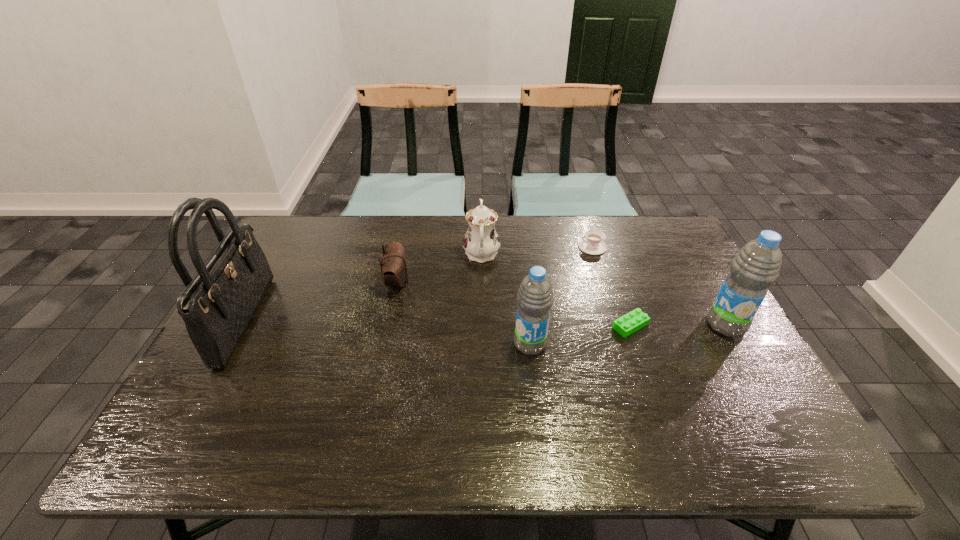
The width and height of the screenshot is (960, 540). I want to click on the leftmost object, so click(217, 305).

The width and height of the screenshot is (960, 540). Identify the location of Lego. (631, 322).

What are the coordinates of `vacant space situated 0.210m on the left of the shorter water bottle` in the screenshot? It's located at (432, 344).

This screenshot has width=960, height=540. Find the location of `vacant area situated on the left of the rightmost object`. vacant area situated on the left of the rightmost object is located at coordinates pos(617,325).

You are a GUI agent. You are given a task and a screenshot of the screen. Output one action in this format:
    pyautogui.click(x=<x>, y=<y>)
    Task: Click on the free spot located on the right of the third object from left to right
    Image resolution: width=960 pixels, height=540 pixels.
    Given the screenshot: What is the action you would take?
    pyautogui.click(x=528, y=254)

Identify the location of vacant space located 0.090m with the flap open on the pouch. (439, 282).

Find the location of `vacant point located 0.300m on the handle side of the second shortest object`. vacant point located 0.300m on the handle side of the second shortest object is located at coordinates (488, 247).

I want to click on vacant area located 0.260m on the handle side of the second shortest object, so click(500, 247).

The height and width of the screenshot is (540, 960). Identify the location of free space located 0.390m on the handle side of the second shortest object. (461, 247).

Where is `vacant region located with an open clasp on the front of the leftmost object`? Image resolution: width=960 pixels, height=540 pixels. vacant region located with an open clasp on the front of the leftmost object is located at coordinates (x=321, y=319).